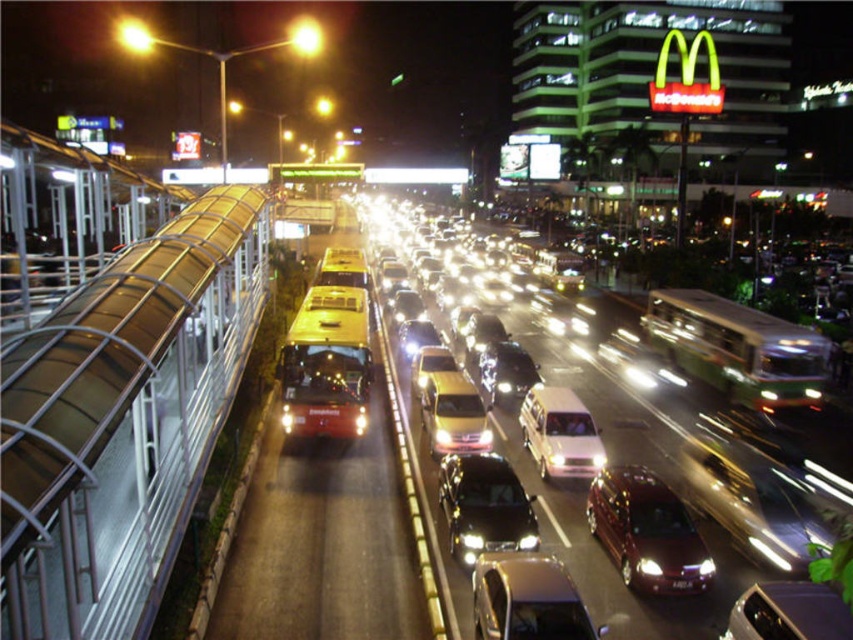
Who is shorter, satin black sedan at center or white matte taxi at center?

satin black sedan at center

Is point (500, 467) more distant than point (532, 417)?

No, it is not.

You are a GUI agent. You are given a task and a screenshot of the screen. Output one action in this format:
    pyautogui.click(x=<x>, y=<y>)
    Task: Click on the satin black sedan at center
    The image size is (853, 640).
    Given the screenshot: What is the action you would take?
    pyautogui.click(x=485, y=506)

Which is above, yellow metallic bus at center or shiny silver car at lower right?

yellow metallic bus at center is higher up.

Who is more distant from viewer, (368, 556) or (775, 593)?

The point (368, 556) is more distant.

This screenshot has width=853, height=640. Describe the element at coordinates (331, 538) in the screenshot. I see `yellow metallic bus at center` at that location.

Where is `yellow metallic bus at center`? This screenshot has height=640, width=853. yellow metallic bus at center is located at coordinates (331, 538).

Does yellow metallic bus at center have a lesser height compared to yellow metallic taxi at center?

No, yellow metallic bus at center is not shorter than yellow metallic taxi at center.

Based on the photo, who is lower down, yellow metallic bus at center or yellow metallic taxi at center?

yellow metallic bus at center is lower down.

You are a GUI agent. You are given a task and a screenshot of the screen. Output one action in this format:
    pyautogui.click(x=<x>, y=<y>)
    Task: Click on the yellow metallic bus at center
    
    Given the screenshot: What is the action you would take?
    pyautogui.click(x=331, y=538)

Where is `yellow metallic bus at center`? The image size is (853, 640). yellow metallic bus at center is located at coordinates (331, 538).